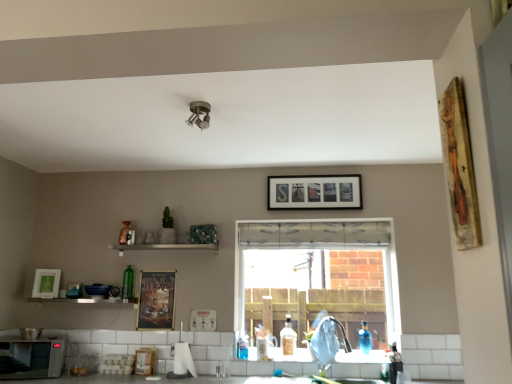
Question: Can you confirm if wooden painting at upper right, which is the fifth picture frame from bottom to top, is positioned to the left of metallic silver shelf at lower center?

Choices:
 (A) no
 (B) yes

Answer: (A)

Question: Is metallic silver shelf at lower center surrounded by wooden painting at upper right, the 5th picture frame from the left?

Choices:
 (A) no
 (B) yes

Answer: (A)

Question: Considering the relative sizes of wooden painting at upper right, the 5th picture frame from the left, and metallic silver shelf at lower center in the image provided, is wooden painting at upper right, the 5th picture frame from the left, wider than metallic silver shelf at lower center?

Choices:
 (A) yes
 (B) no

Answer: (B)

Question: Considering the relative sizes of wooden painting at upper right, which ranks as the first picture frame in top-to-bottom order, and metallic silver shelf at lower center in the image provided, is wooden painting at upper right, which ranks as the first picture frame in top-to-bottom order, shorter than metallic silver shelf at lower center?

Choices:
 (A) yes
 (B) no

Answer: (B)

Question: Does wooden painting at upper right, which ranks as the first picture frame in top-to-bottom order, have a larger size compared to metallic silver shelf at lower center?

Choices:
 (A) yes
 (B) no

Answer: (B)

Question: Does wooden painting at upper right, which is the fifth picture frame from bottom to top, have a lesser width compared to metallic silver shelf at lower center?

Choices:
 (A) yes
 (B) no

Answer: (A)

Question: Is green glass bottle at shelf, which is the first bottle in left-to-right order, closer to camera compared to white fabric window at center?

Choices:
 (A) yes
 (B) no

Answer: (B)

Question: Can you confirm if green glass bottle at shelf, the fourth bottle from the right, is shorter than white fabric window at center?

Choices:
 (A) no
 (B) yes

Answer: (B)

Question: Does green glass bottle at shelf, which is the first bottle in back-to-front order, have a smaller size compared to white fabric window at center?

Choices:
 (A) no
 (B) yes

Answer: (B)

Question: From the image's perspective, is green glass bottle at shelf, placed as the 4th bottle when sorted from front to back, located above white fabric window at center?

Choices:
 (A) no
 (B) yes

Answer: (B)

Question: Considering the relative sizes of green glass bottle at shelf, which is the first bottle in back-to-front order, and white fabric window at center in the image provided, is green glass bottle at shelf, which is the first bottle in back-to-front order, bigger than white fabric window at center?

Choices:
 (A) yes
 (B) no

Answer: (B)

Question: Could you tell me if green glass bottle at shelf, which is the first bottle in left-to-right order, is facing white fabric window at center?

Choices:
 (A) no
 (B) yes

Answer: (A)

Question: Is blue glass bottle at lower right, the 2th bottle in the front-to-back sequence, to the left of metallic poster at center, marked as the 4th picture frame in a front-to-back arrangement, from the viewer's perspective?

Choices:
 (A) yes
 (B) no

Answer: (B)